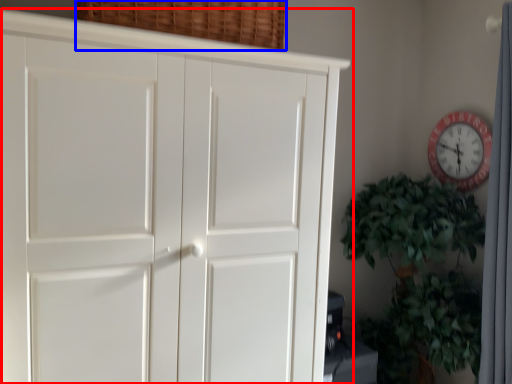
Question: Among these objects, which one is nearest to the camera, cupboard (highlighted by a red box) or basket (highlighted by a blue box)?

Choices:
 (A) cupboard
 (B) basket

Answer: (A)